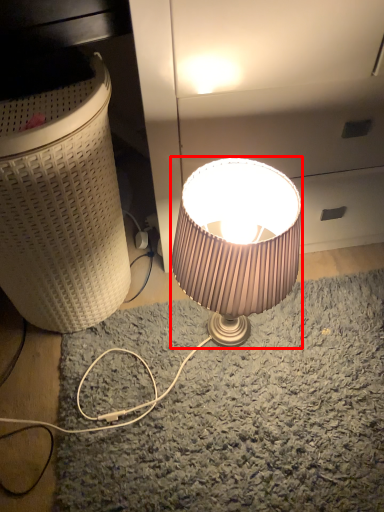
Question: From the image's perspective, where is lamp (annotated by the red box) located relative to laundry basket?

Choices:
 (A) above
 (B) below

Answer: (B)